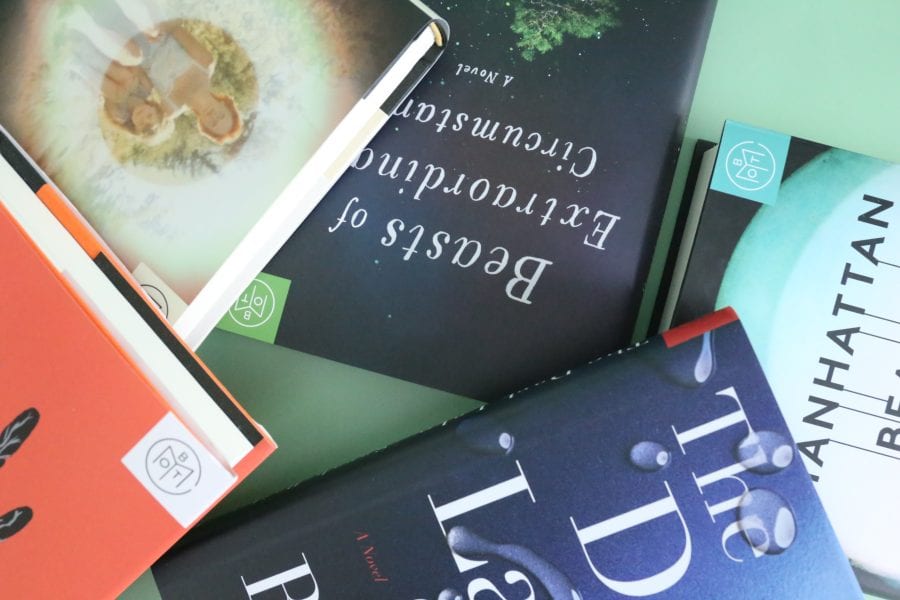
The width and height of the screenshot is (900, 600). Find the location of `light green book`. light green book is located at coordinates (815, 262).